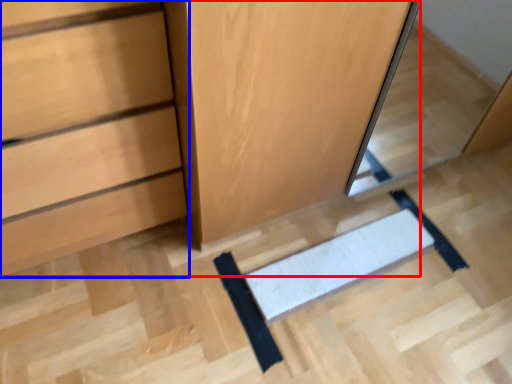
Question: Which of the following is the farthest to the observer, dresser (highlighted by a red box) or chest of drawers (highlighted by a blue box)?

Choices:
 (A) dresser
 (B) chest of drawers

Answer: (A)